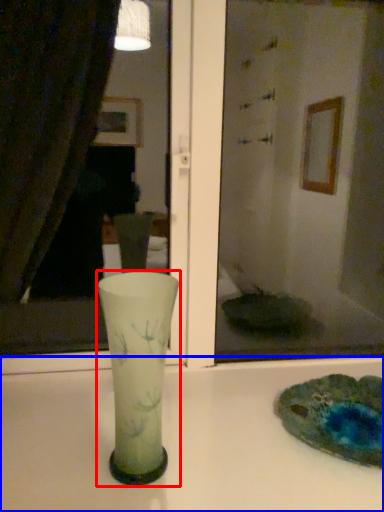
Question: Which of the following is the closest to the observer, vase (highlighted by a red box) or counter top (highlighted by a blue box)?

Choices:
 (A) vase
 (B) counter top

Answer: (B)